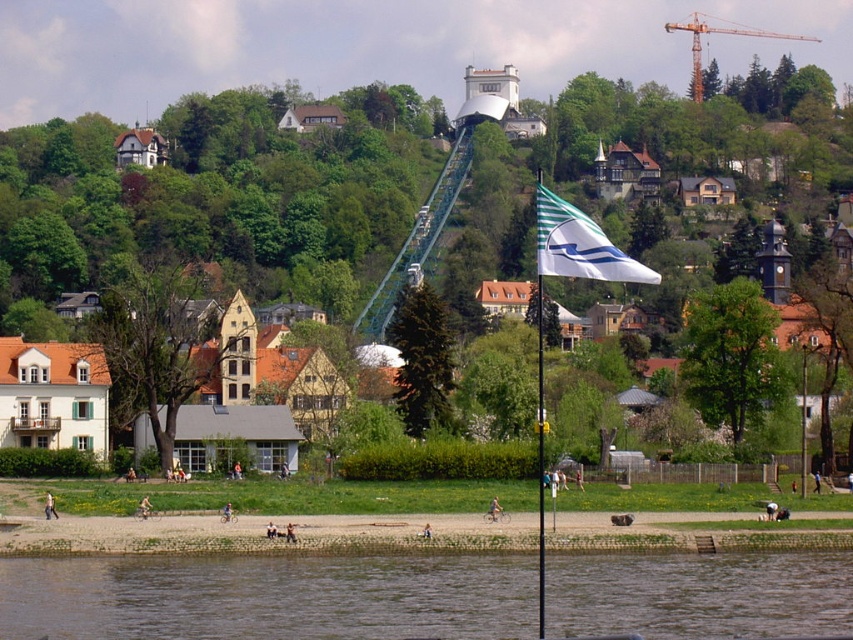
Question: Which of the following is the closest to the observer?

Choices:
 (A) brown muddy water at lower center
 (B) orange metallic crane at upper center

Answer: (A)

Question: Which object is closer to the camera taking this photo?

Choices:
 (A) white fabric flag at center
 (B) white matte flag at center

Answer: (A)

Question: Is white matte flag at center to the right of white fabric flag at center from the viewer's perspective?

Choices:
 (A) yes
 (B) no

Answer: (B)

Question: Does brown muddy water at lower center appear over orange metallic crane at upper center?

Choices:
 (A) no
 (B) yes

Answer: (A)

Question: Is white matte flag at center to the right of white fabric flag at center from the viewer's perspective?

Choices:
 (A) no
 (B) yes

Answer: (A)

Question: Which object is farther from the camera taking this photo?

Choices:
 (A) orange metallic crane at upper center
 (B) white fabric flag at center

Answer: (A)